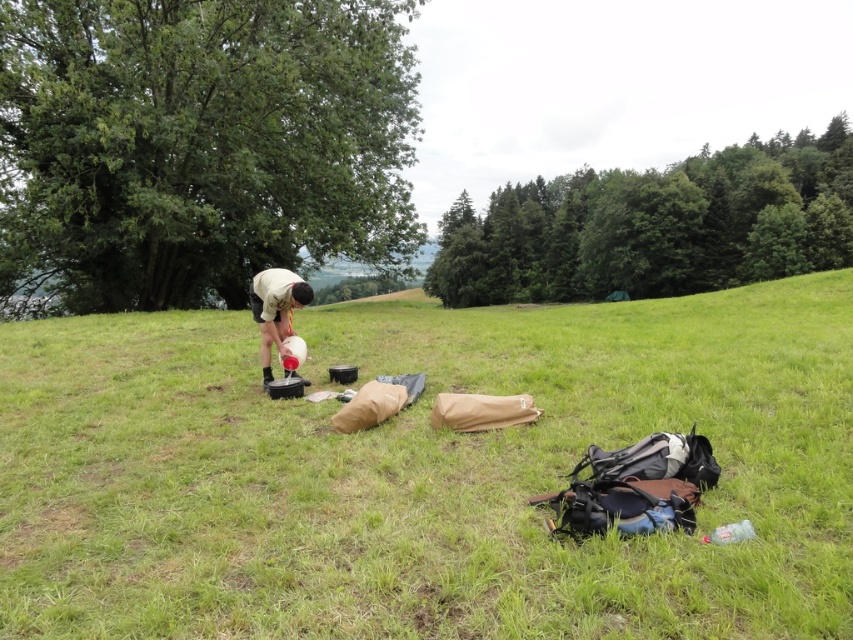
You are standing in the outdoor scene and want to find the white matte shirt at center. Based on the green grassy field at center, which direction should you look to locate it?

The green grassy field at center is positioned on the right side of white matte shirt at center, so you should look to your left to find the white matte shirt at center.

You are trying to decide whether to lay down on the green grassy field at center for a nap. Considering the height of the white matte shirt at center, do you think the grass might tickle your face?

The green grassy field at center is much taller than the white matte shirt at center, so yes, the grass is likely to tickle your face when lying down.